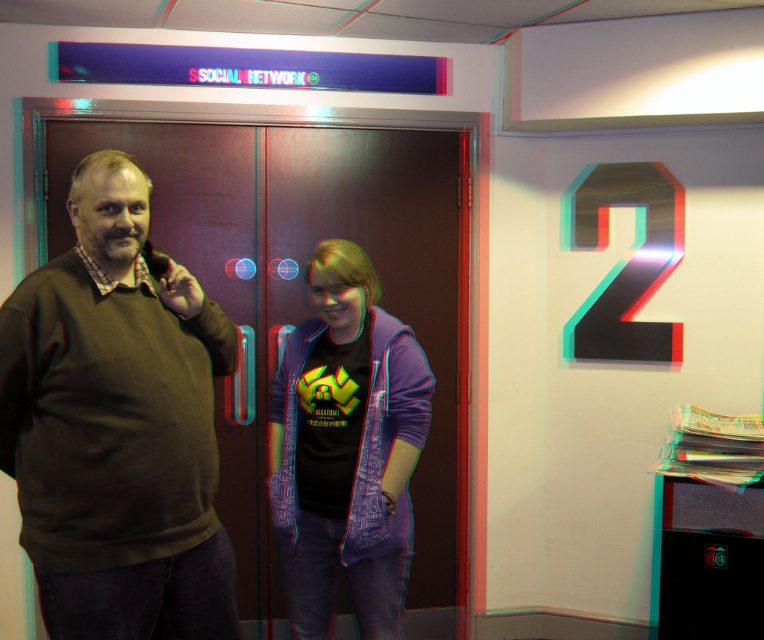
Does brown matte sweater at left have a lesser width compared to matte purple jacket at center?

No.

Is point (108, 580) farther from viewer compared to point (387, 369)?

No, it is not.

Where is `brown matte sweater at left`? The height and width of the screenshot is (640, 764). brown matte sweater at left is located at coordinates (115, 426).